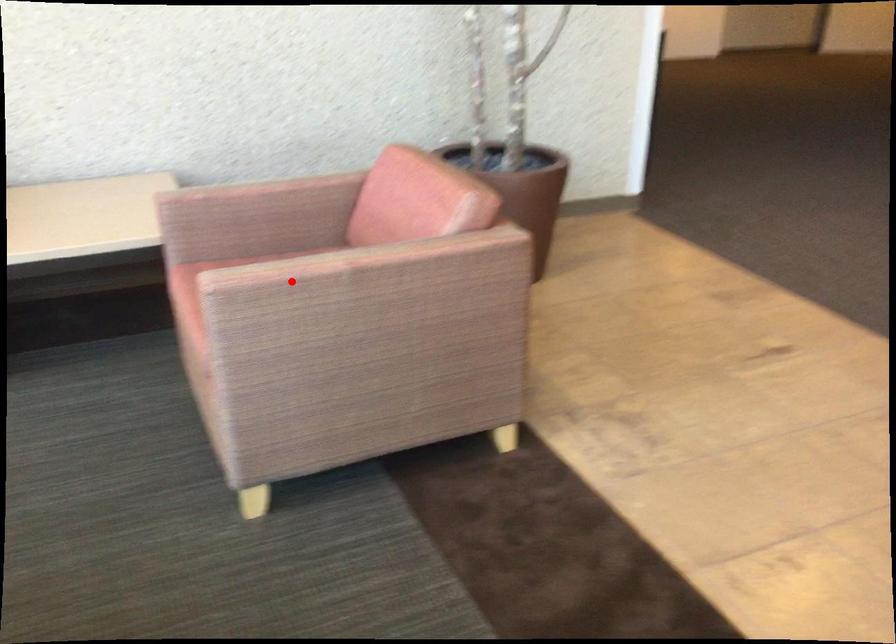
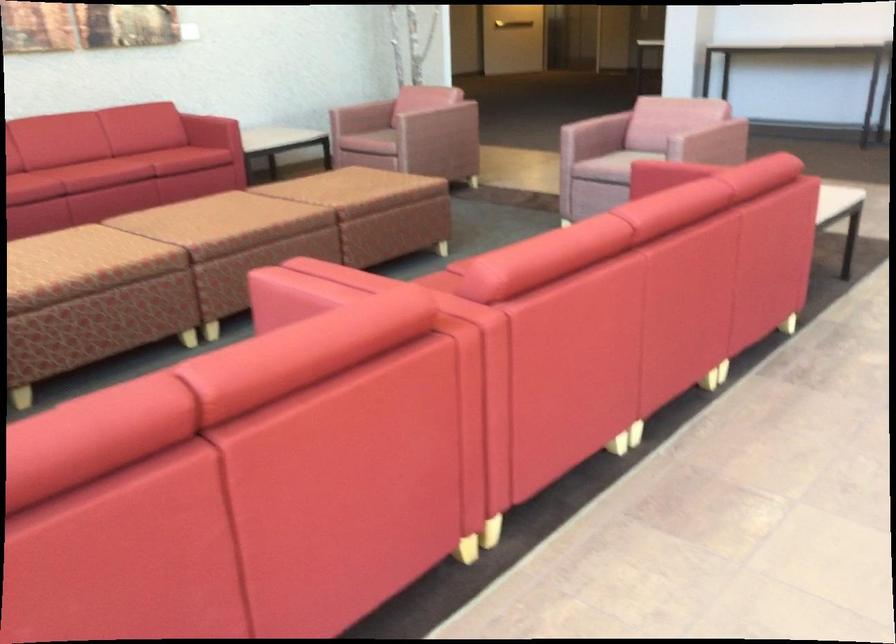
Question: I am providing you with two images of the same scene from different viewpoints. A red point is shown in image1. For the corresponding object point in image2, is it positioned nearer or farther from the camera?

Choices:
 (A) Nearer
 (B) Farther

Answer: (B)